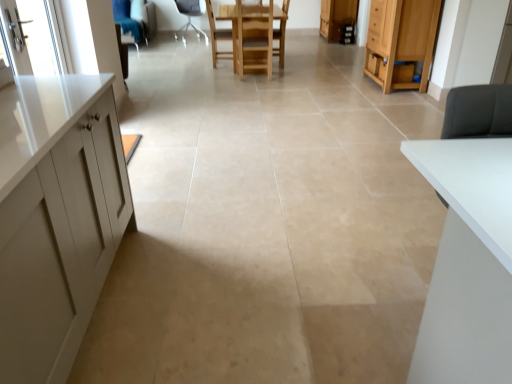
Question: Considering their positions, is wooden chair at center, the 2th chair in the back-to-front sequence, located in front of or behind wooden cabinet at upper right, the 2th cabinetry positioned from the front?

Choices:
 (A) front
 (B) behind

Answer: (A)

Question: Would you say wooden chair at center, the 2th chair in the back-to-front sequence, is inside or outside wooden cabinet at upper right, the 2th cabinetry positioned from the front?

Choices:
 (A) outside
 (B) inside

Answer: (A)

Question: Considering the real-world distances, which object is farthest from the wooden cabinet at right, the second cabinetry when ordered from back to front?

Choices:
 (A) wooden chair at center, which ranks as the 2th chair in right-to-left order
 (B) wooden cabinet at upper right, acting as the 1th cabinetry starting from the top
 (C) wooden chair at center
 (D) white fabric chair at center, which is counted as the 3th chair, starting from the right
 (E) wooden chair at center, marked as the 3th chair in a left-to-right arrangement

Answer: (D)

Question: Based on their relative distances, which object is farther from the white fabric chair at center, the first chair positioned from the left?

Choices:
 (A) wooden cabinet at right, the first cabinetry when ordered from bottom to top
 (B) wooden chair at center
 (C) wooden chair at center, the first chair in the front-to-back sequence
 (D) wooden chair at center, the 2th chair when ordered from left to right
 (E) wooden cabinet at upper right, acting as the first cabinetry starting from the back

Answer: (A)